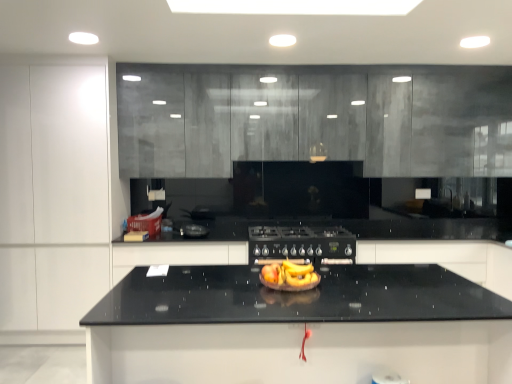
Question: Does black granite countertop at center lie behind yellow matte bananas at center?

Choices:
 (A) no
 (B) yes

Answer: (A)

Question: Is black granite countertop at center with yellow matte bananas at center?

Choices:
 (A) yes
 (B) no

Answer: (B)

Question: Does black granite countertop at center have a lesser width compared to yellow matte bananas at center?

Choices:
 (A) no
 (B) yes

Answer: (A)

Question: Is yellow matte bananas at center completely or partially inside black granite countertop at center?

Choices:
 (A) no
 (B) yes

Answer: (A)

Question: Does black granite countertop at center appear on the right side of yellow matte bananas at center?

Choices:
 (A) yes
 (B) no

Answer: (A)

Question: Does black granite countertop at center have a smaller size compared to yellow matte bananas at center?

Choices:
 (A) no
 (B) yes

Answer: (A)

Question: Does yellow matte bananas at center have a greater width compared to matte gray cabinets at upper center, which is counted as the second cabinetry, starting from the right?

Choices:
 (A) yes
 (B) no

Answer: (B)

Question: Is yellow matte bananas at center looking in the opposite direction of matte gray cabinets at upper center, which is counted as the second cabinetry, starting from the right?

Choices:
 (A) no
 (B) yes

Answer: (A)

Question: Is yellow matte bananas at center positioned beyond the bounds of matte gray cabinets at upper center, the 3th cabinetry when ordered from left to right?

Choices:
 (A) yes
 (B) no

Answer: (A)

Question: Can you confirm if yellow matte bananas at center is shorter than matte gray cabinets at upper center, which is counted as the second cabinetry, starting from the right?

Choices:
 (A) yes
 (B) no

Answer: (A)

Question: Is yellow matte bananas at center in contact with matte gray cabinets at upper center, which is counted as the second cabinetry, starting from the right?

Choices:
 (A) yes
 (B) no

Answer: (B)

Question: Is yellow matte bananas at center at the right side of matte gray cabinets at upper center, the 3th cabinetry when ordered from left to right?

Choices:
 (A) no
 (B) yes

Answer: (A)

Question: Is yellow matte bananas at center next to black matte gas stove at center?

Choices:
 (A) no
 (B) yes

Answer: (A)